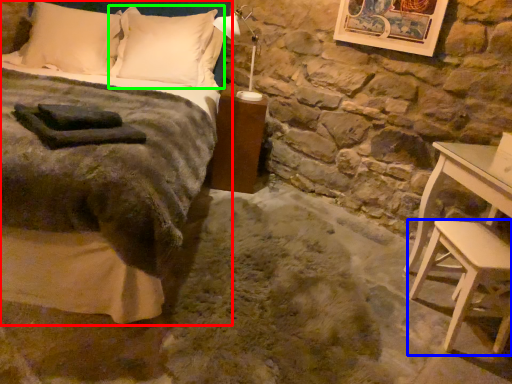
Question: Which object is positioned farthest from bed (highlighted by a red box)? Select from stool (highlighted by a blue box) and pillow (highlighted by a green box).

Choices:
 (A) stool
 (B) pillow

Answer: (A)